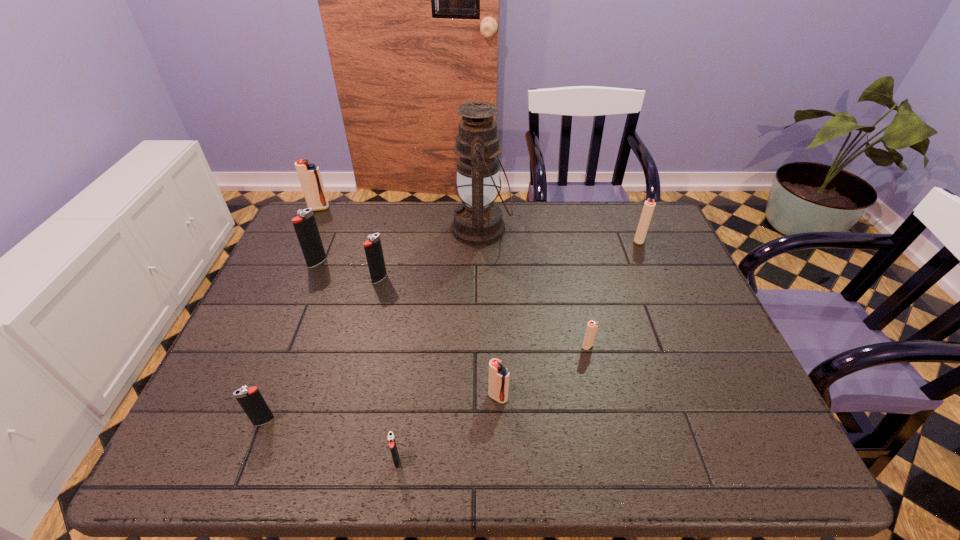
Locate an element on the screen. Image resolution: width=960 pixels, height=540 pixels. the second nearest black igniter is located at coordinates (252, 402).

The width and height of the screenshot is (960, 540). Identify the location of the sixth farthest igniter. (498, 375).

I want to click on the third nearest object, so tap(498, 375).

Where is `the sixth farthest object`? The width and height of the screenshot is (960, 540). the sixth farthest object is located at coordinates (592, 326).

In order to click on the fourth nearest igniter in this screenshot , I will do `click(592, 326)`.

Where is `the rightmost black igniter`? the rightmost black igniter is located at coordinates (391, 440).

Locate an element on the screen. Image resolution: width=960 pixels, height=540 pixels. the fifth object from right to left is located at coordinates (391, 440).

Identify the location of blank space located on the front of the oil lamp. This screenshot has height=540, width=960. (482, 316).

Locate an element on the screen. This screenshot has width=960, height=540. free space located on the front of the leftmost object is located at coordinates (304, 240).

The height and width of the screenshot is (540, 960). In order to click on vacant point located on the back of the third farthest igniter in this screenshot , I will do `click(339, 210)`.